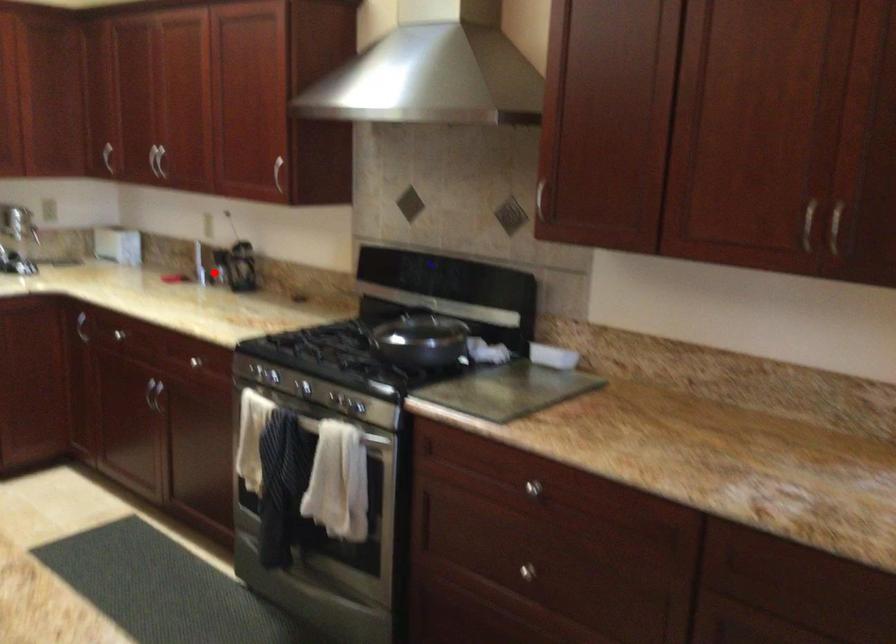
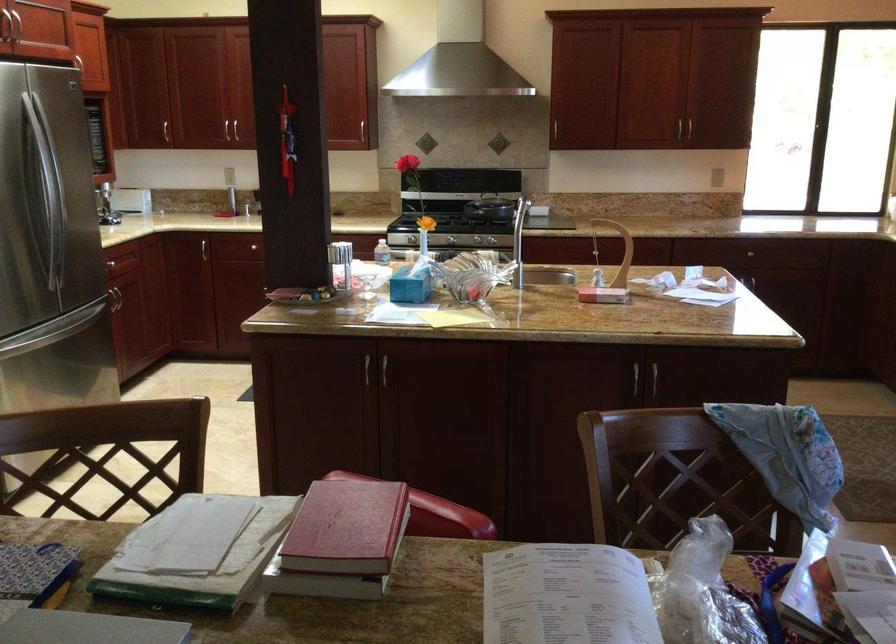
Question: I am providing you with two images of the same scene from different viewpoints. Image1 has a red point marked. In image2, the corresponding 3D location appears at what relative position? Reply with the corresponding letter.

Choices:
 (A) Closer
 (B) Farther

Answer: (B)